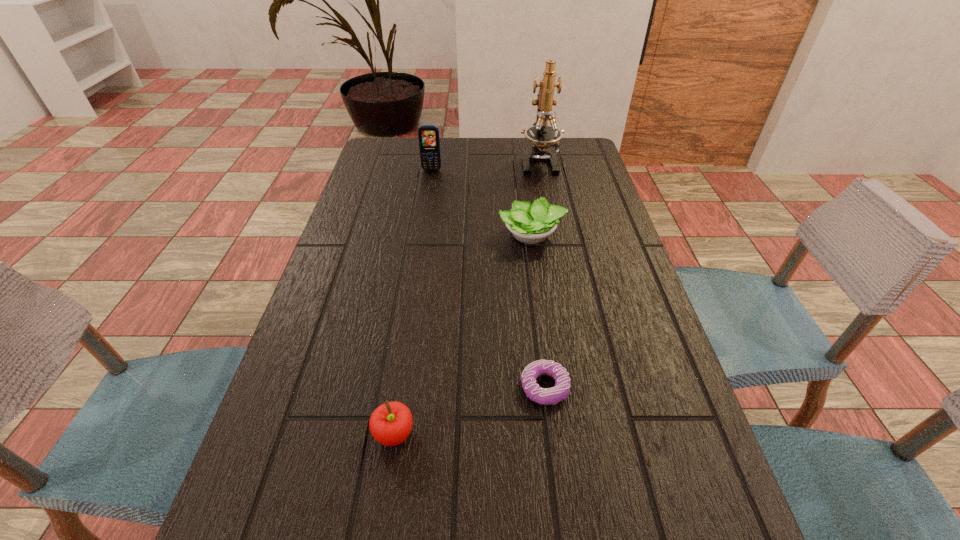
What are the coordinates of `the tallest object` in the screenshot? It's located at (542, 136).

Where is `the second tallest object`? The image size is (960, 540). the second tallest object is located at coordinates (428, 135).

The height and width of the screenshot is (540, 960). I want to click on apple, so click(x=390, y=424).

The image size is (960, 540). What are the coordinates of `the third farthest object` in the screenshot? It's located at (529, 223).

Image resolution: width=960 pixels, height=540 pixels. I want to click on doughnut, so click(545, 396).

This screenshot has width=960, height=540. I want to click on free space located 0.140m at the eyepiece of the tallest object, so click(547, 205).

This screenshot has height=540, width=960. What are the coordinates of `vacant space situated 0.220m on the screen of the cellular telephone` in the screenshot? It's located at (425, 212).

The width and height of the screenshot is (960, 540). I want to click on vacant region located 0.330m on the back of the fifth farthest object, so click(x=417, y=284).

Locate an element on the screen. The width and height of the screenshot is (960, 540). vacant area situated on the right of the lettuce is located at coordinates (588, 235).

Identify the location of vacant space located on the back of the fourth farthest object. Image resolution: width=960 pixels, height=540 pixels. (528, 255).